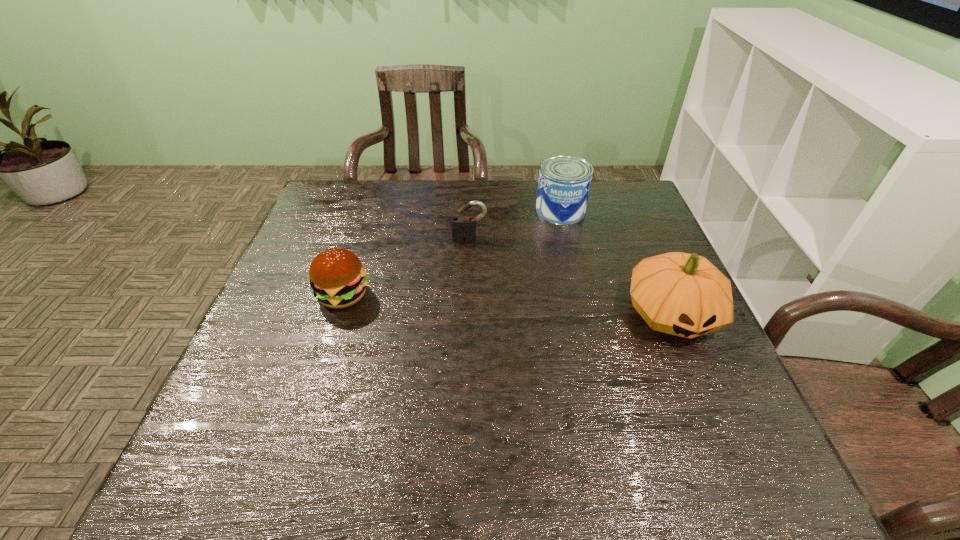
At what (x,y) coordinates should I click in order to perform the action: click on empty space that is in between the leftmost object and the third nearest object. Please return your answer as a coordinate pair (x, y). Image resolution: width=960 pixels, height=540 pixels. Looking at the image, I should click on (406, 267).

Find the location of `blank region between the padlock and the rightmost object`. blank region between the padlock and the rightmost object is located at coordinates (570, 276).

I want to click on the second closest object relative to the third nearest object, so click(337, 278).

Locate which object is the second closest to the tallest object. Please provide its 2D coordinates. Your answer should be formatted as a tuple, i.e. [(x, y)], where the tuple contains the x and y coordinates of a point satisfying the conditions above.

[(463, 227)]

At what (x,y) coordinates should I click in order to perform the action: click on free space that satisfies the following two spatial constraints: 1. on the back side of the leftmost object; 2. on the right side of the third object from left to right. Please return your answer as a coordinate pair (x, y). Image resolution: width=960 pixels, height=540 pixels. Looking at the image, I should click on (370, 211).